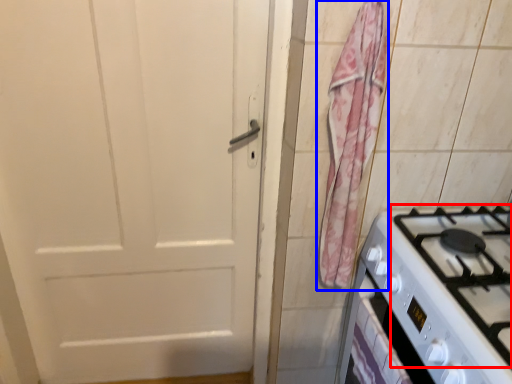
Question: Which object appears farthest to the camera in this image, gas stove (highlighted by a red box) or curtain (highlighted by a blue box)?

Choices:
 (A) gas stove
 (B) curtain

Answer: (B)